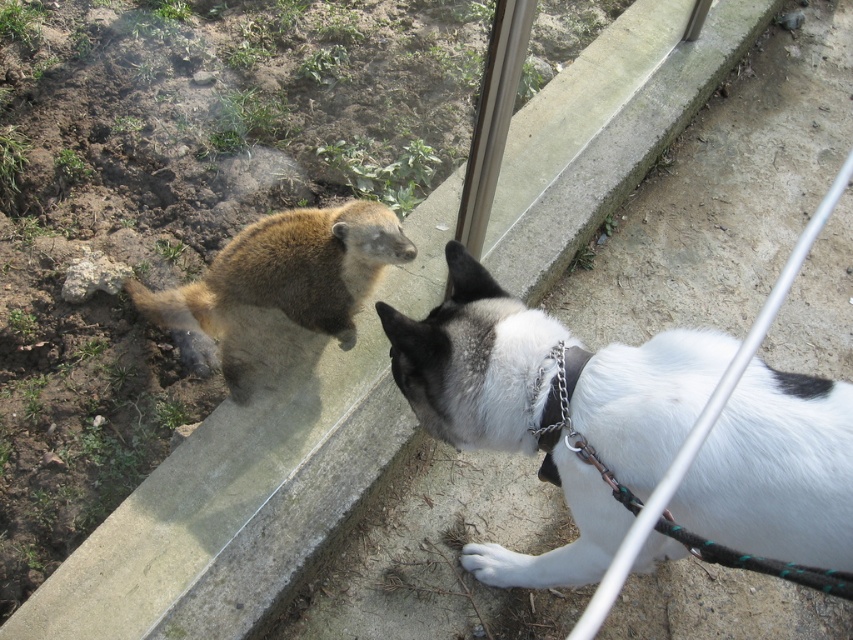
Between point (347, 353) and point (495, 557), which one is positioned behind?

The point (347, 353) is behind.

Image resolution: width=853 pixels, height=640 pixels. Find the location of `transparent glass door at upper center`. transparent glass door at upper center is located at coordinates (229, 467).

Between point (306, 381) and point (502, 561), which one is positioned behind?

The point (306, 381) is more distant.

Where is `transparent glass door at upper center`? The width and height of the screenshot is (853, 640). transparent glass door at upper center is located at coordinates (229, 467).

Which is more to the left, white fur paw at lower center or metal chain at lower right?

Positioned to the left is white fur paw at lower center.

Is white fur paw at lower center to the right of metal chain at lower right from the viewer's perspective?

Incorrect, white fur paw at lower center is not on the right side of metal chain at lower right.

Is point (519, 570) positioned behind point (569, 372)?

Yes, point (519, 570) is farther from viewer.

Where is `white fur paw at lower center`? The image size is (853, 640). white fur paw at lower center is located at coordinates (498, 564).

Can you confirm if brown fur animal at upper left is thinner than metal chain at lower right?

No.

Is point (368, 273) farther from camera compared to point (546, 442)?

Yes, point (368, 273) is behind point (546, 442).

You are a GUI agent. You are given a task and a screenshot of the screen. Output one action in this format:
    pyautogui.click(x=<x>, y=<y>)
    Task: Click on the brown fur animal at upper left
    Image resolution: width=853 pixels, height=640 pixels.
    Given the screenshot: What is the action you would take?
    pyautogui.click(x=277, y=285)